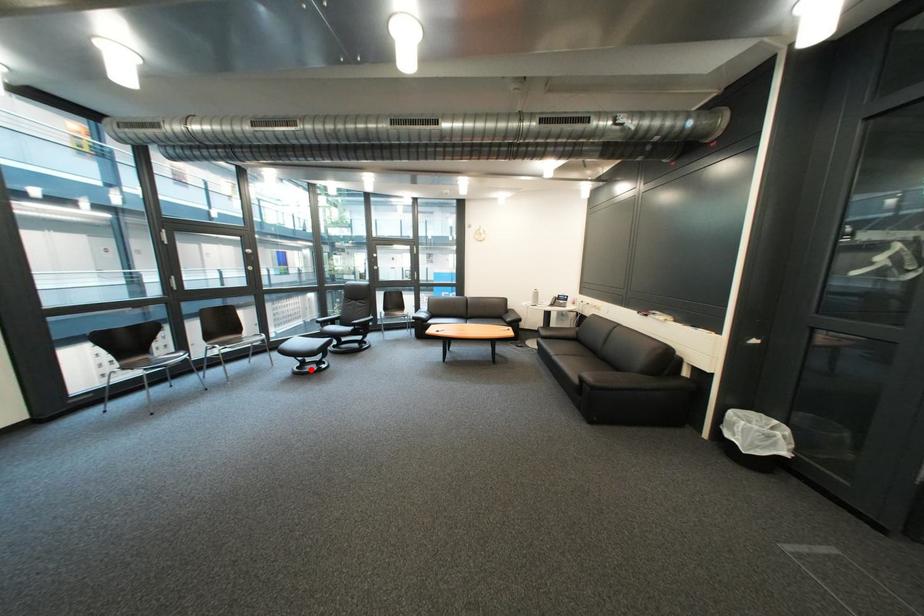
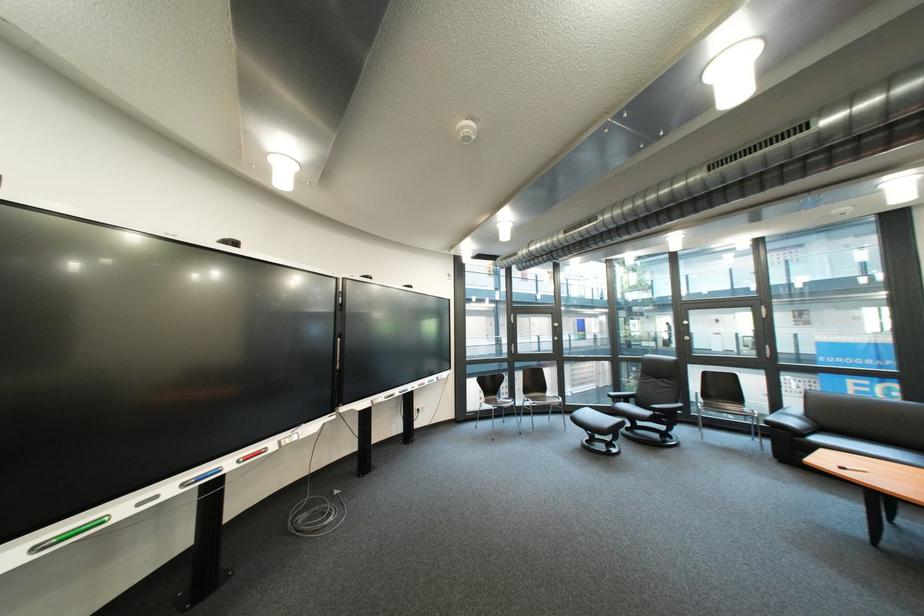
Question: A red point is marked in image1. In image2, is the corresponding 3D point closer to the camera or farther? Reply with the corresponding letter.

Choices:
 (A) The corresponding 3D point is closer.
 (B) The corresponding 3D point is farther.

Answer: (B)